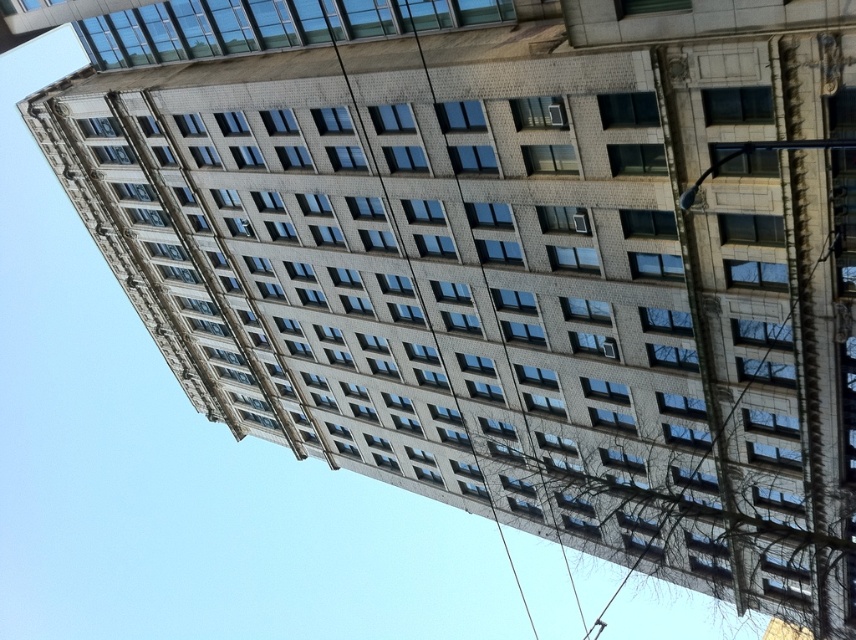
Is metallic wire at upper right in front of smooth wire at center?

Yes, it is in front of smooth wire at center.

Between metallic wire at upper right and smooth wire at center, which one is positioned higher?

metallic wire at upper right is above.

Who is more forward, (746, 420) or (364, 140)?

Point (746, 420) is in front.

Identify the location of metallic wire at upper right. This screenshot has height=640, width=856. (710, 397).